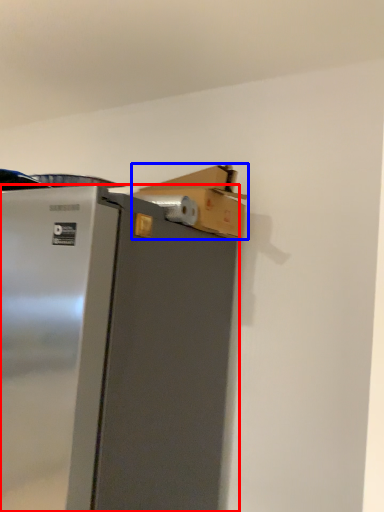
Question: Which object is further to the camera taking this photo, refrigerator (highlighted by a red box) or cardboard box (highlighted by a blue box)?

Choices:
 (A) refrigerator
 (B) cardboard box

Answer: (B)